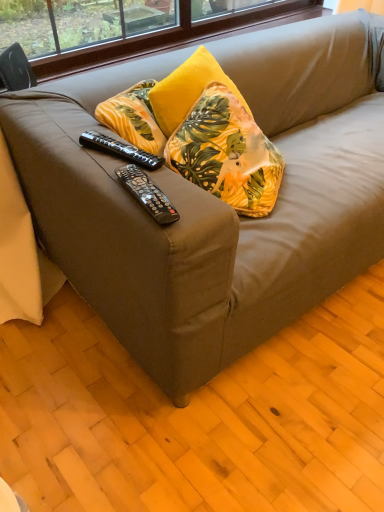
Find the location of a particular element. vacant space behind black plastic remote control at center, which is the 2th remote control from top to bottom is located at coordinates (134, 164).